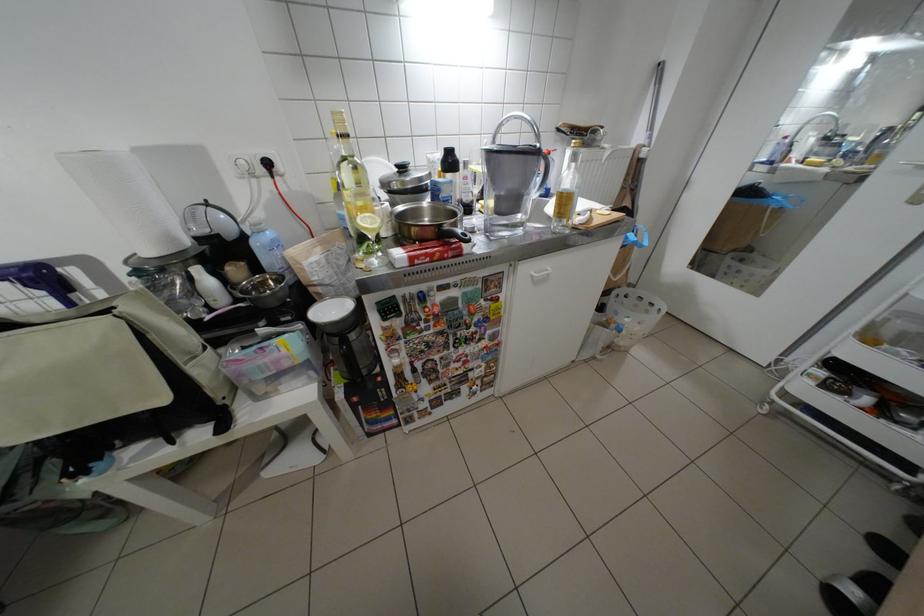
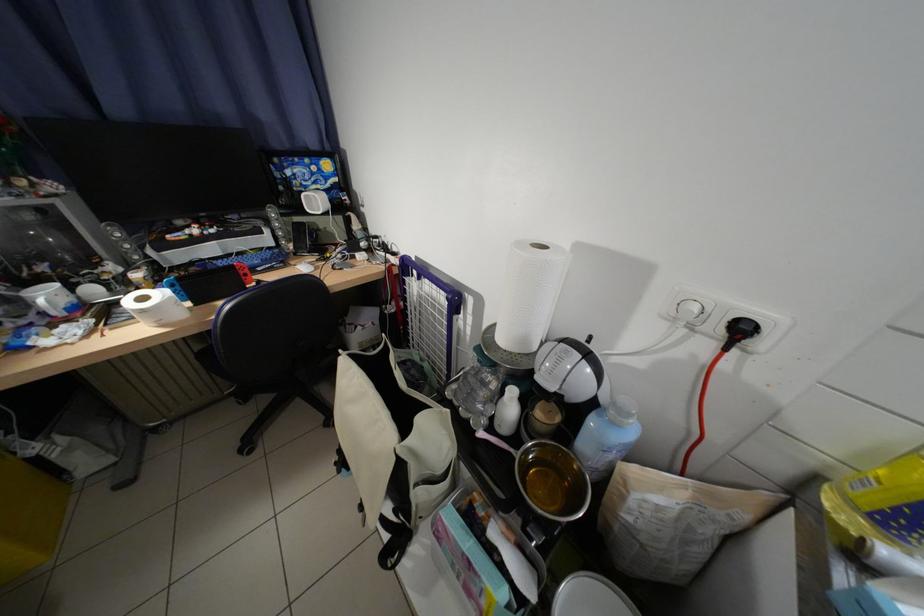
The point at [162,254] is marked in the first image. Where is the corresponding point in the second image?

(514, 341)